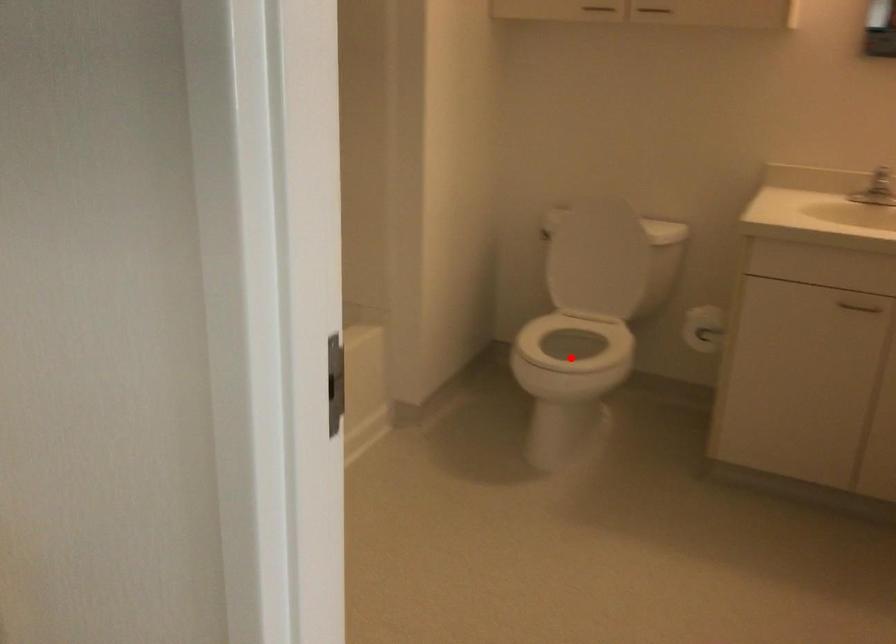
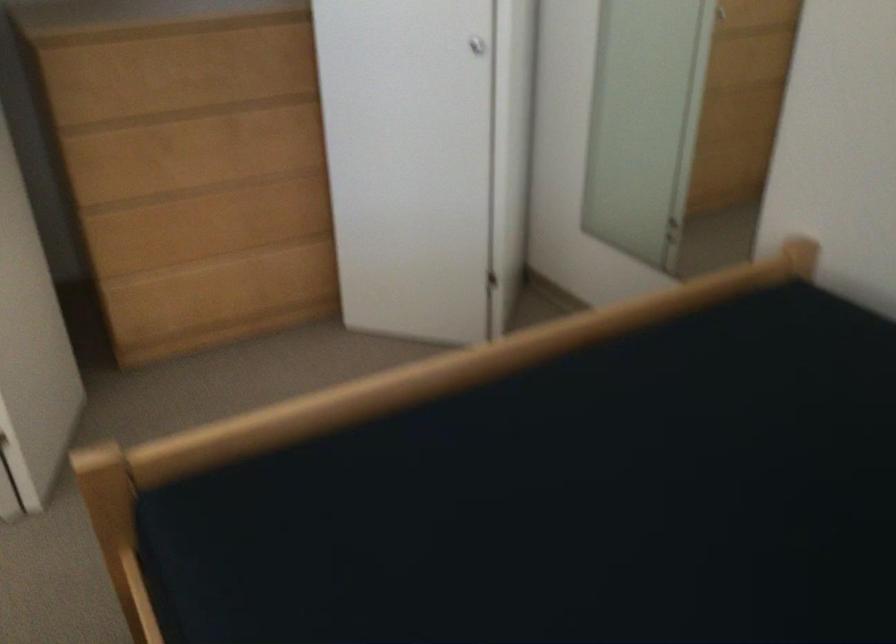
Question: I am providing you with two images of the same scene from different viewpoints. A red point is marked on the first image. At the location where the point appears in image 1, is it still visible in image 2?

Choices:
 (A) Yes
 (B) No

Answer: (B)